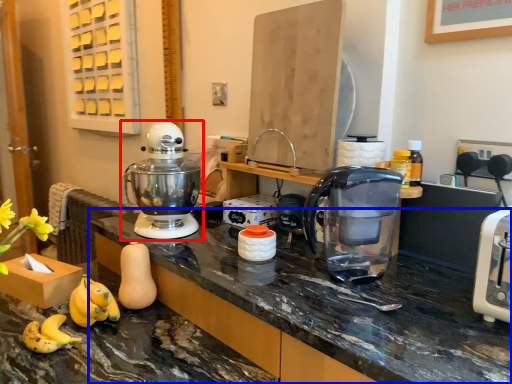
Question: Which object appears closest to the camera in this image, mixer (highlighted by a red box) or countertop (highlighted by a blue box)?

Choices:
 (A) mixer
 (B) countertop

Answer: (B)